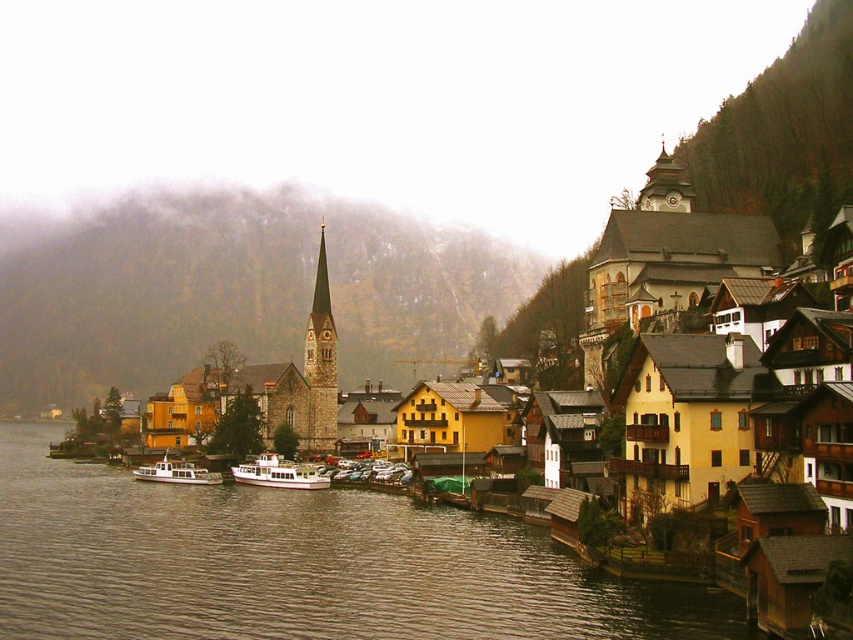
Can you confirm if yellow wooden houses at center is wider than white matte boat at lower left?

Indeed, yellow wooden houses at center has a greater width compared to white matte boat at lower left.

Describe the element at coordinates (288, 564) in the screenshot. The height and width of the screenshot is (640, 853). I see `yellow wooden houses at center` at that location.

The width and height of the screenshot is (853, 640). Find the location of `yellow wooden houses at center`. yellow wooden houses at center is located at coordinates (288, 564).

Is brown water at lower left to the right of smooth stone spire at center from the viewer's perspective?

In fact, brown water at lower left is to the left of smooth stone spire at center.

Does brown water at lower left lie in front of smooth stone spire at center?

Yes, brown water at lower left is closer to the viewer.

The width and height of the screenshot is (853, 640). I want to click on brown water at lower left, so click(296, 564).

Between brown water at lower left and white matte boat at lower left, which one has less height?

white matte boat at lower left is shorter.

Is brown water at lower left bigger than white matte boat at lower left?

Indeed, brown water at lower left has a larger size compared to white matte boat at lower left.

Between point (239, 588) and point (164, 454), which one is positioned in front?

Point (239, 588) is more forward.

The image size is (853, 640). In order to click on brown water at lower left in this screenshot , I will do `click(296, 564)`.